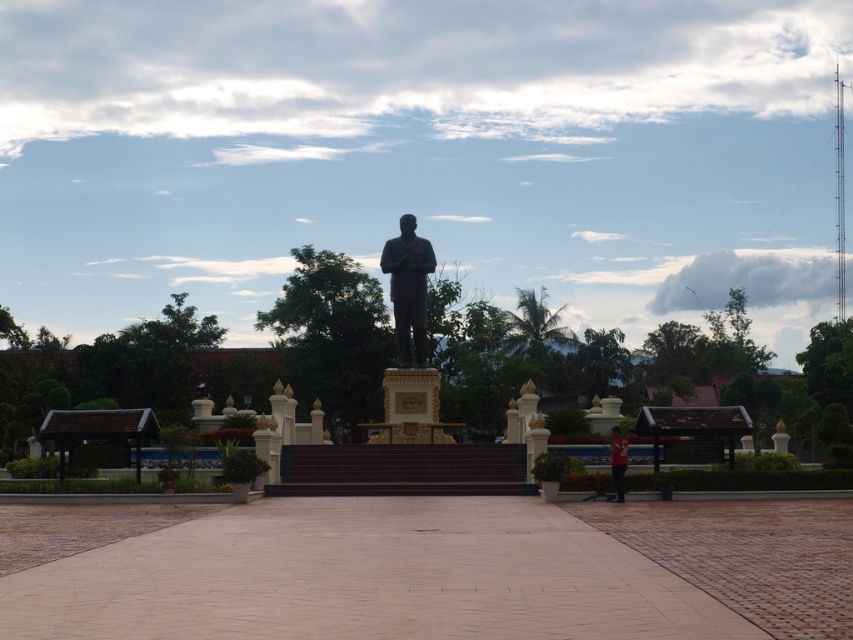
Consider the image. You are a tour guide leading a group around the outdoor area. You want to ensure visitors can comfortably walk between the black polished statue at center and the bronze statue at center. If the average person requires 24 inches of space to walk comfortably, can they comfortably pass between these two statues?

The distance between the black polished statue at center and the bronze statue at center is 16.95 inches, which is less than the required 24 inches for comfortable walking. Therefore, visitors may find it cramped and not comfortable to pass between them.

What object is located at the coordinates point (409,332) in the image?

The point (409,332) marks the location of the black polished statue at center.

You are standing in the outdoor area and want to take a photo of the black polished statue at center. If your camera has a maximum focus range of 50 meters, will you be able to capture a clear image of the statue from your current position?

The black polished statue at center is 48.38 meters away from the viewer. Since the camera can focus up to 50 meters, you can capture a clear image as the distance is within the camera range.